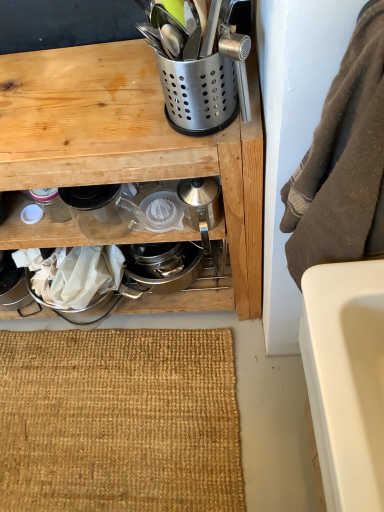
Image resolution: width=384 pixels, height=512 pixels. I want to click on vacant space in burlap mat at lower center (from a real-world perspective), so click(x=105, y=411).